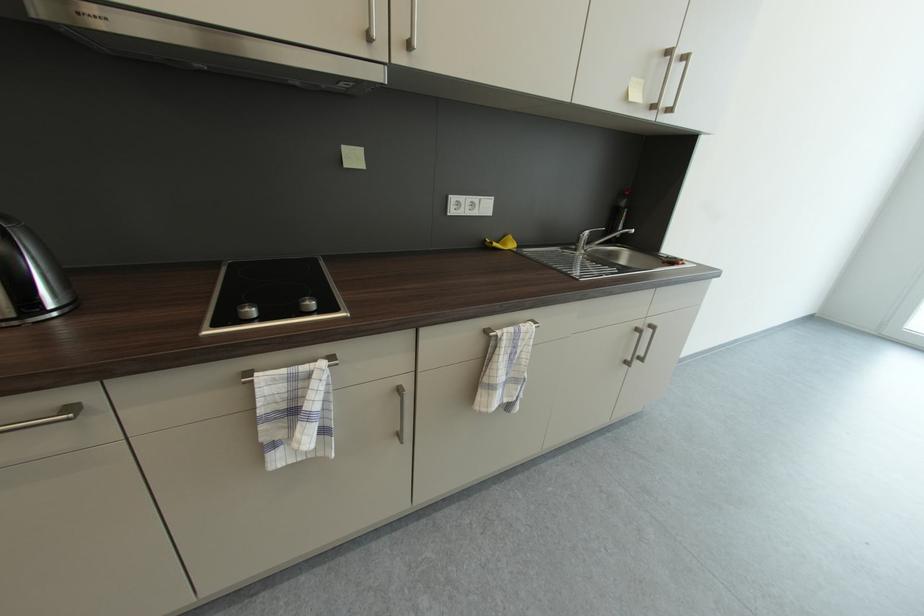
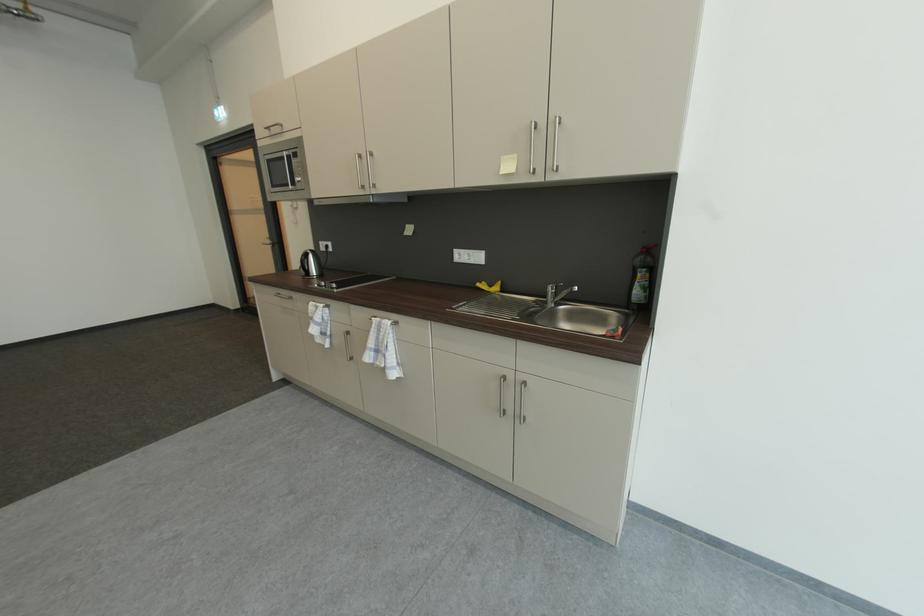
Locate, in the second image, the point that corresponds to point 481,215 in the first image.

(479, 262)